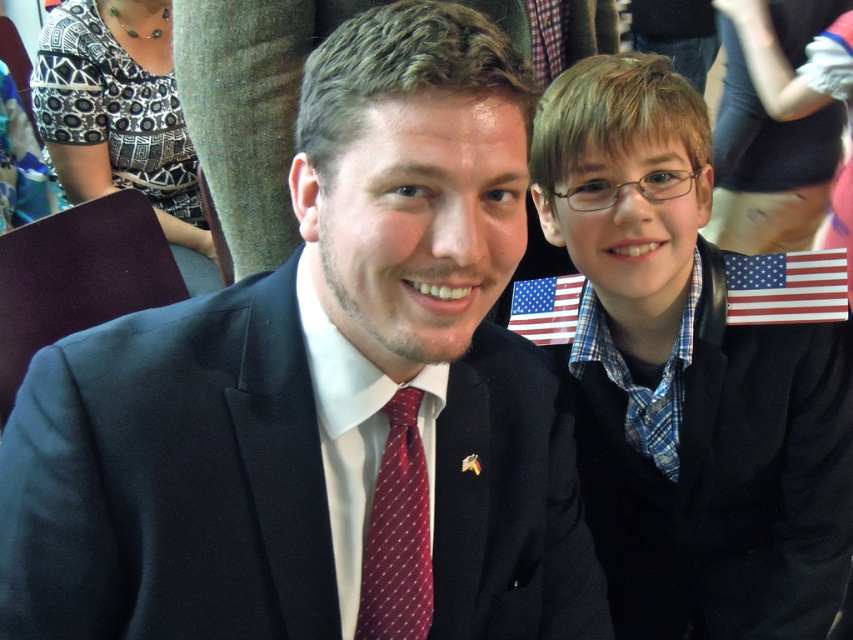
Which is in front, point (244, 410) or point (810, 276)?

Point (244, 410) is in front.

Does point (215, 632) lie behind point (776, 300)?

That is False.

Find the location of a particular element. matte black suit at center is located at coordinates (323, 396).

Can you confirm if maroon silk tie at center is positioned above american flag at upper right?

No.

Who is higher up, maroon silk tie at center or american flag at upper right?

Positioned higher is american flag at upper right.

Who is more distant from viewer, (383, 490) or (814, 321)?

The point (814, 321) is behind.

I want to click on maroon silk tie at center, so click(x=398, y=532).

Which is more to the right, matte black suit at center or american flag at center?

american flag at center is more to the right.

Which of these two, matte black suit at center or american flag at center, stands shorter?

american flag at center

Identify the location of matte black suit at center. This screenshot has height=640, width=853. (323, 396).

This screenshot has width=853, height=640. In order to click on matte black suit at center in this screenshot , I will do `click(323, 396)`.